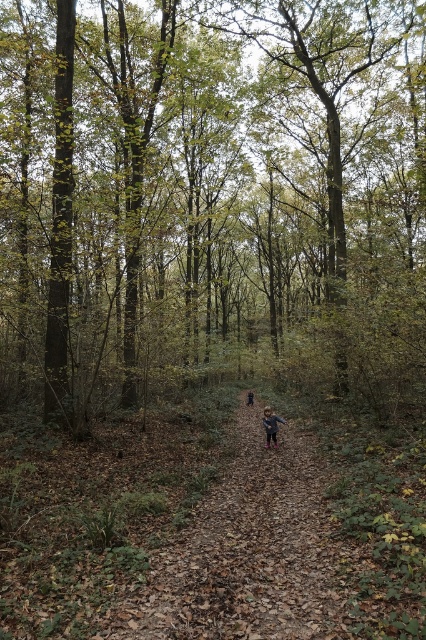
Question: Which point is farther to the camera?

Choices:
 (A) (249, 397)
 (B) (379, 305)

Answer: (A)

Question: Is brown wood tree at center to the left of blue fabric person at center from the viewer's perspective?

Choices:
 (A) no
 (B) yes

Answer: (A)

Question: Among these points, which one is nearest to the camera?

Choices:
 (A) pos(273,444)
 (B) pos(158,208)

Answer: (A)

Question: Which is nearer to the brown wood tree at center?

Choices:
 (A) blue fabric person at center
 (B) light brown leather boots at center

Answer: (A)

Question: Where is light brown leather boots at center located in relation to blue fabric person at center in the image?

Choices:
 (A) left
 (B) right

Answer: (A)

Question: From the image, what is the correct spatial relationship of light brown leather boots at center in relation to blue fabric person at center?

Choices:
 (A) below
 (B) above

Answer: (B)